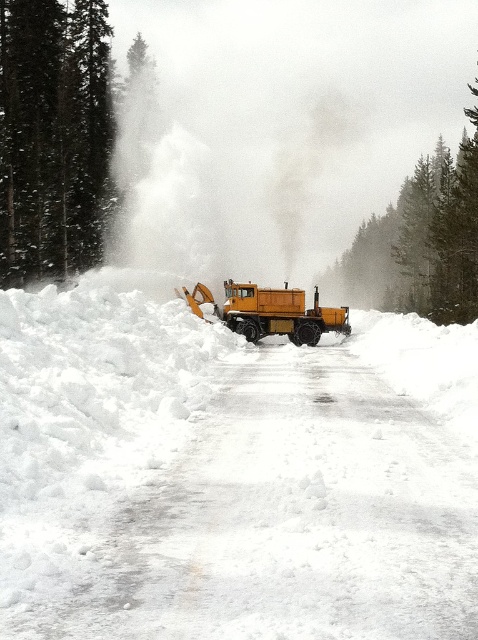
Question: Can you confirm if white powdery steam at center is positioned to the right of yellow matte truck at center?

Choices:
 (A) no
 (B) yes

Answer: (A)

Question: Which of the following is the farthest from the observer?

Choices:
 (A) white powdery steam at center
 (B) white fluffy snow at center

Answer: (A)

Question: Does white fluffy snow at center have a greater width compared to white powdery steam at center?

Choices:
 (A) yes
 (B) no

Answer: (B)

Question: Which point is farther to the camera?

Choices:
 (A) (278, 154)
 (B) (95, 432)
 (C) (301, 316)

Answer: (A)

Question: Which point appears farthest from the camera in this image?

Choices:
 (A) coord(329,330)
 (B) coord(239,221)

Answer: (B)

Question: Observing the image, what is the correct spatial positioning of white fluffy snow at center in reference to white powdery steam at center?

Choices:
 (A) right
 (B) left

Answer: (A)